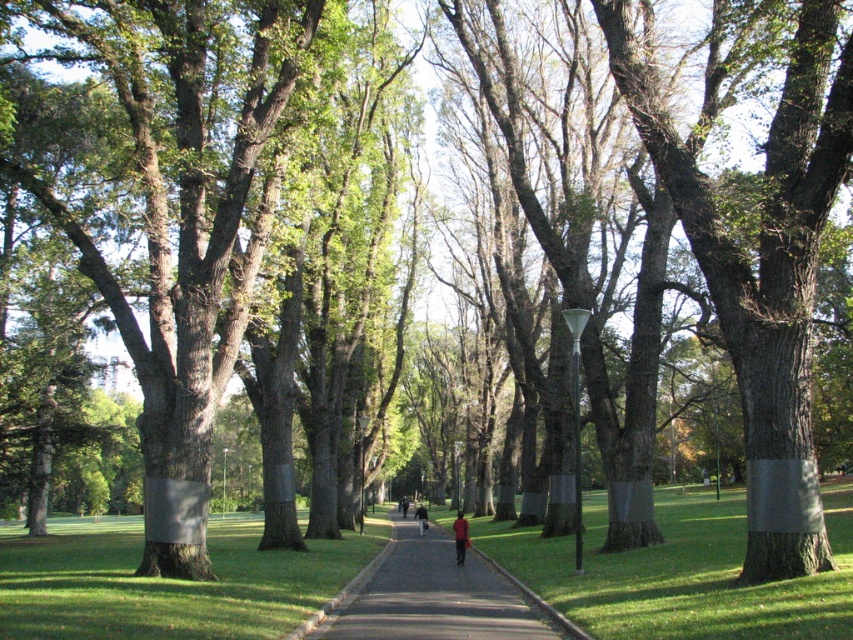
Question: Can you confirm if smooth gray bark at center is bigger than dark brown leather jacket at center?

Choices:
 (A) yes
 (B) no

Answer: (B)

Question: Based on their relative distances, which object is farther from the black asphalt path at center?

Choices:
 (A) red shirt at center
 (B) smooth gray bark at center

Answer: (B)

Question: Which point appears farthest from the camera in this image?

Choices:
 (A) (466, 525)
 (B) (795, 189)
 (C) (431, 573)

Answer: (C)

Question: From the image, what is the correct spatial relationship of smooth gray bark at center in relation to dark brown leather jacket at center?

Choices:
 (A) above
 (B) below

Answer: (A)

Question: Which object appears farthest from the camera in this image?

Choices:
 (A) black asphalt path at center
 (B) red shirt at center
 (C) dark brown leather jacket at center
 (D) smooth gray bark at center

Answer: (C)

Question: Can you confirm if red shirt at center is bigger than dark brown leather jacket at center?

Choices:
 (A) yes
 (B) no

Answer: (B)